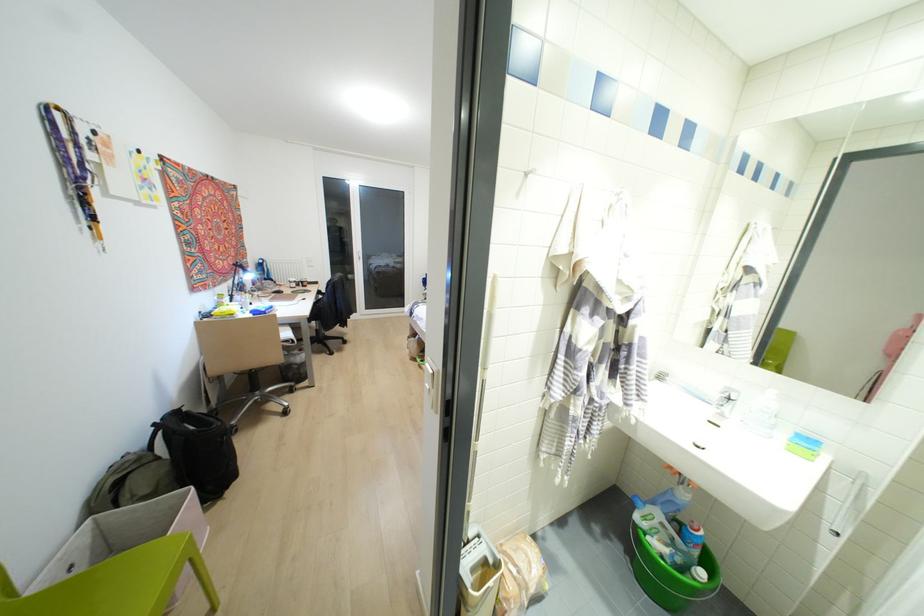
At what (x,y) coordinates should I click in order to perform the action: click on faucet handle. Please return your answer as a coordinate pair (x, y). Looking at the image, I should click on (725, 400).